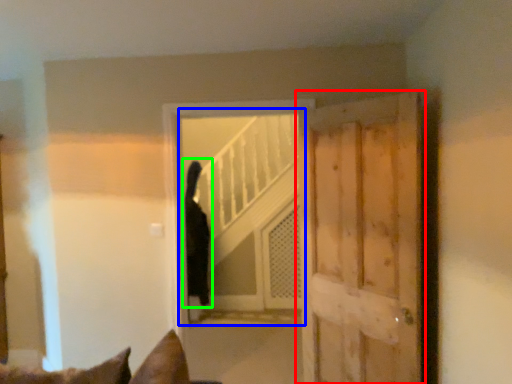
Question: Considering the real-world distances, which object is closest to door (highlighted by a red box)? elevator (highlighted by a blue box) or cat (highlighted by a green box).

Choices:
 (A) elevator
 (B) cat

Answer: (B)